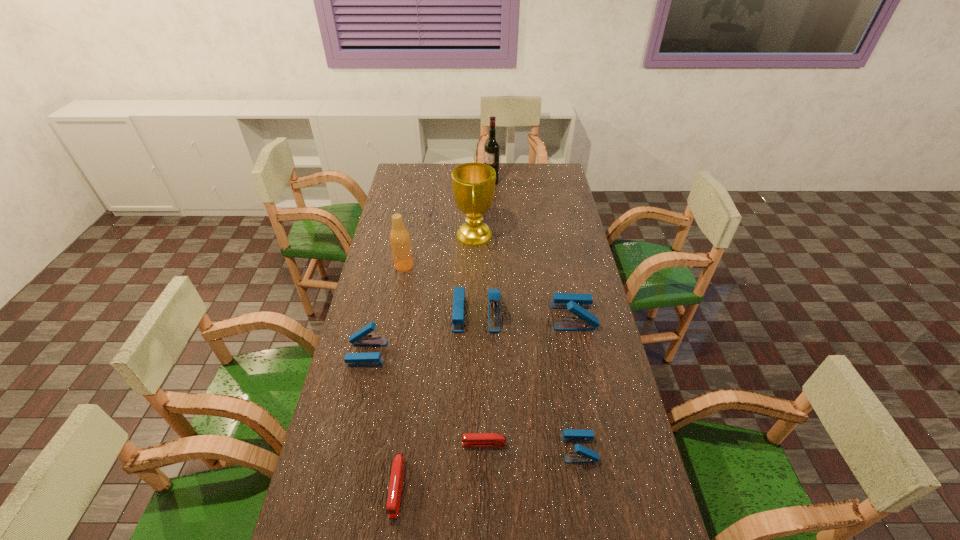
The image size is (960, 540). What are the coordinates of `unoccupied position between the tan beer bottle and the fourth nearest stapler` in the screenshot? It's located at (385, 309).

Find the location of `vacant space that is in between the fifth stapler from right to left and the shortest stapler`. vacant space that is in between the fifth stapler from right to left and the shortest stapler is located at coordinates (441, 465).

Where is `blank region between the beer bottle and the fifth tallest stapler`? blank region between the beer bottle and the fifth tallest stapler is located at coordinates (400, 376).

Identify which object is the fourth nearest to the third shortest stapler. Please provide its 2D coordinates. Your answer should be formatted as a tuple, i.e. [(x, y)], where the tuple contains the x and y coordinates of a point satisfying the conditions above.

[(397, 473)]

Identify the location of the fifth closest object relative to the fifth stapler from right to left. The height and width of the screenshot is (540, 960). click(x=576, y=303).

Find the location of a particular element. The image size is (960, 540). stapler that is the second closest to the fourth tallest stapler is located at coordinates (576, 303).

Identify which stapler is the third nearest to the third farthest object. Please provide its 2D coordinates. Your answer should be formatted as a tuple, i.e. [(x, y)], where the tuple contains the x and y coordinates of a point satisfying the conditions above.

[(576, 303)]

Choose which blue stapler is the third nearest neighbor to the farthest object. Please provide its 2D coordinates. Your answer should be formatted as a tuple, i.e. [(x, y)], where the tuple contains the x and y coordinates of a point satisfying the conditions above.

[(360, 338)]

The height and width of the screenshot is (540, 960). I want to click on blue stapler that stands as the second closest to the sixth shortest object, so click(360, 338).

Identify which red stapler is located as the second nearest to the golden award. Please provide its 2D coordinates. Your answer should be formatted as a tuple, i.e. [(x, y)], where the tuple contains the x and y coordinates of a point satisfying the conditions above.

[(397, 473)]